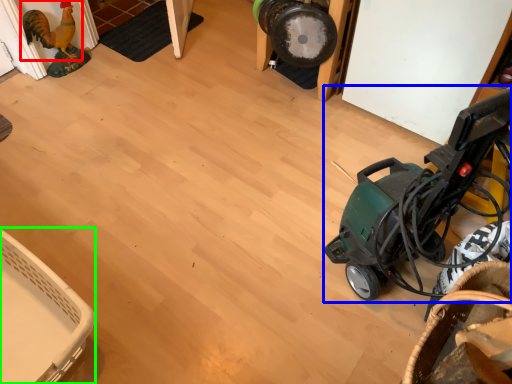
Question: Which is farther away from chicken (highlighted by a red box)? baby carriage (highlighted by a blue box) or basket (highlighted by a green box)?

Choices:
 (A) baby carriage
 (B) basket

Answer: (A)